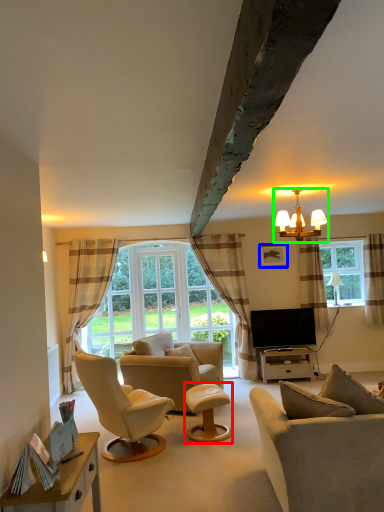
Question: Which is farther away from stool (highlighted by a red box)? picture frame (highlighted by a blue box) or lamp (highlighted by a green box)?

Choices:
 (A) picture frame
 (B) lamp

Answer: (A)